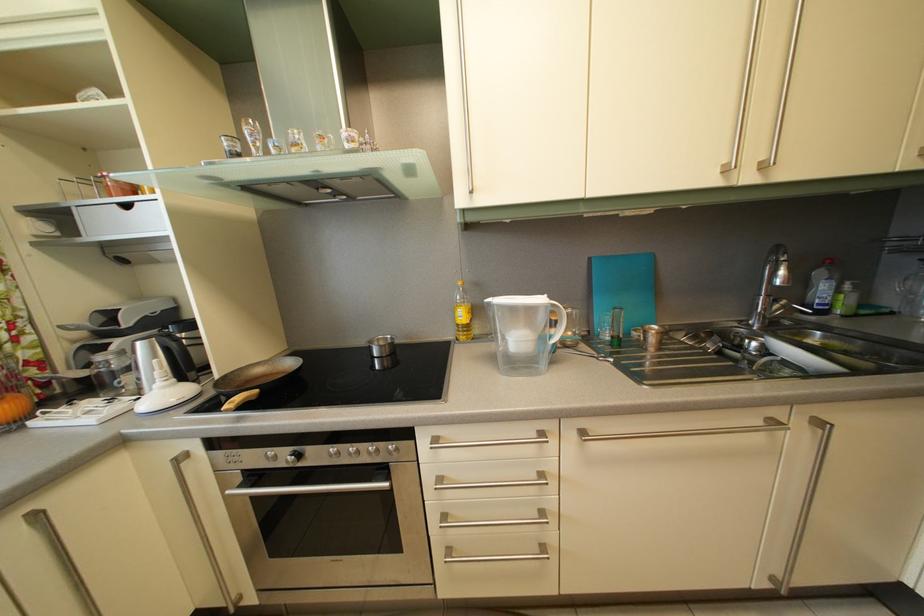
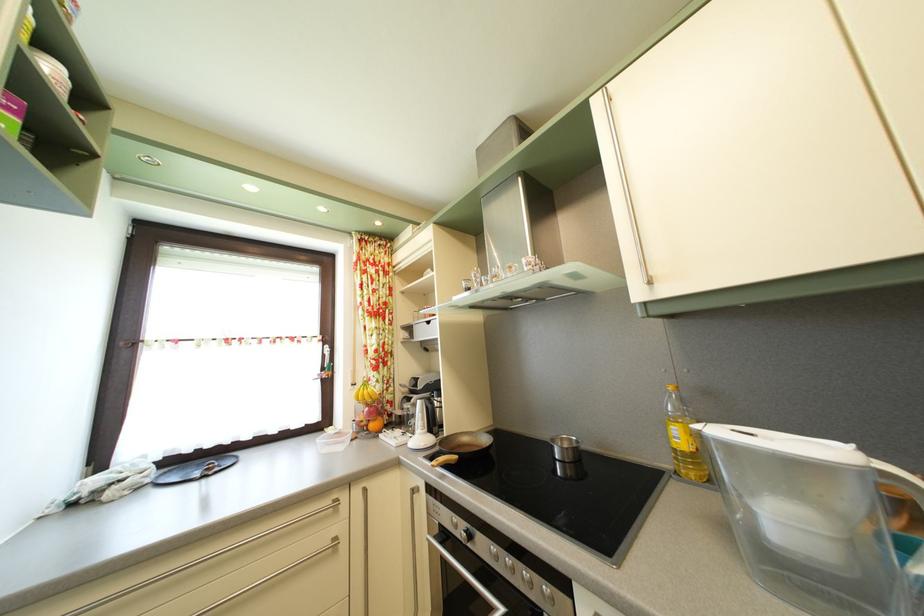
Find the pixel in the second image that matches pixel 346 461 in the first image.

(505, 565)